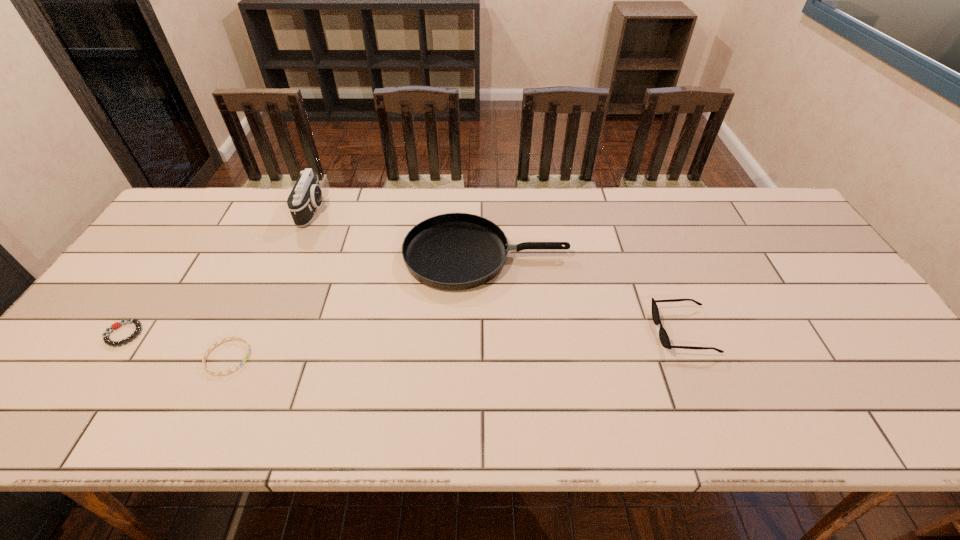
This screenshot has width=960, height=540. In order to click on free space at the near left corner of the desktop in this screenshot , I will do `click(69, 403)`.

Locate an element on the screen. vacant space at the near right corner of the desktop is located at coordinates (905, 433).

Identify the location of free point between the sunglasses and the right bracelet. The width and height of the screenshot is (960, 540). (456, 344).

At what (x,y) coordinates should I click in order to perform the action: click on blank region between the frying pan and the camera. Please return your answer as a coordinate pair (x, y). This screenshot has height=540, width=960. Looking at the image, I should click on (399, 233).

Identify the location of vacant area that lies between the frying pan and the leftmost object. Image resolution: width=960 pixels, height=540 pixels. (305, 295).

The width and height of the screenshot is (960, 540). I want to click on vacant area that lies between the right bracelet and the camera, so click(270, 284).

This screenshot has width=960, height=540. In order to click on free point between the leftmost object and the frying pan in this screenshot , I will do `click(305, 295)`.

At what (x,y) coordinates should I click in order to perform the action: click on free spot between the frying pan and the sunglasses. Please return your answer as a coordinate pair (x, y). Looking at the image, I should click on (585, 293).

What are the coordinates of `unoccupied position between the right bracelet and the sunglasses` in the screenshot? It's located at (456, 344).

The image size is (960, 540). In order to click on empty space between the right bracelet and the second object from right to left in this screenshot , I will do `click(357, 306)`.